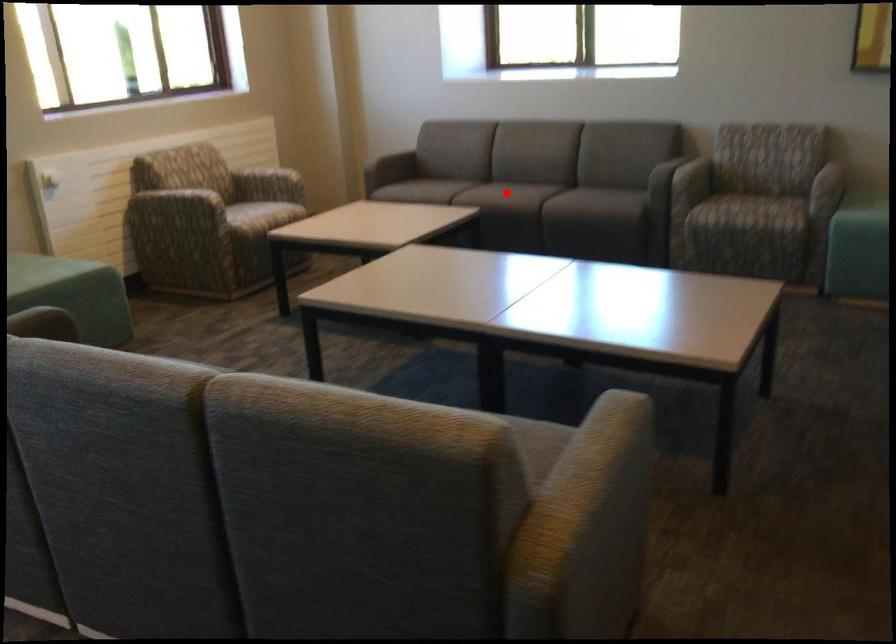
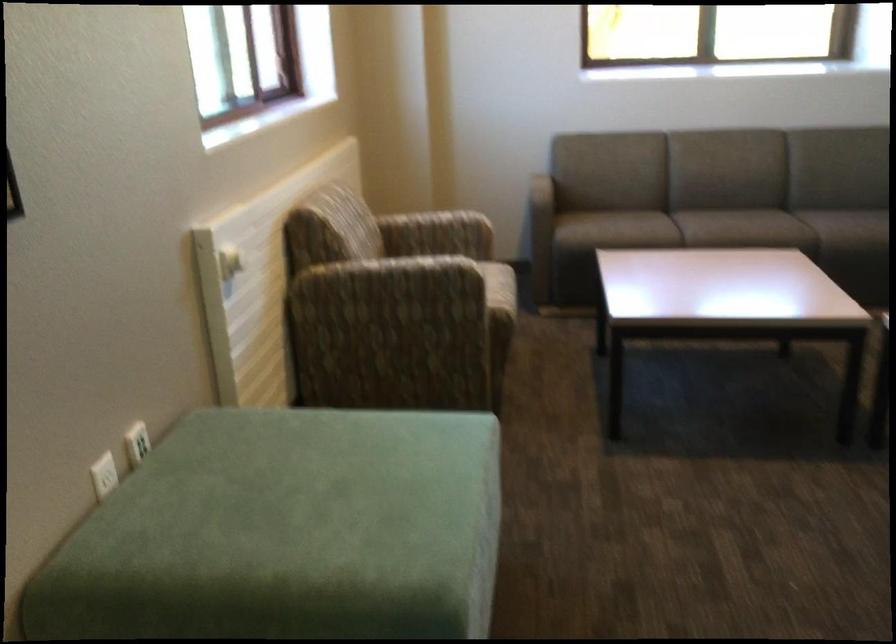
Question: I am providing you with two images of the same scene from different viewpoints. In image1, a red point is highlighted. Considering the same 3D point in image2, which of the following is correct?

Choices:
 (A) It is closer
 (B) It is farther

Answer: (A)